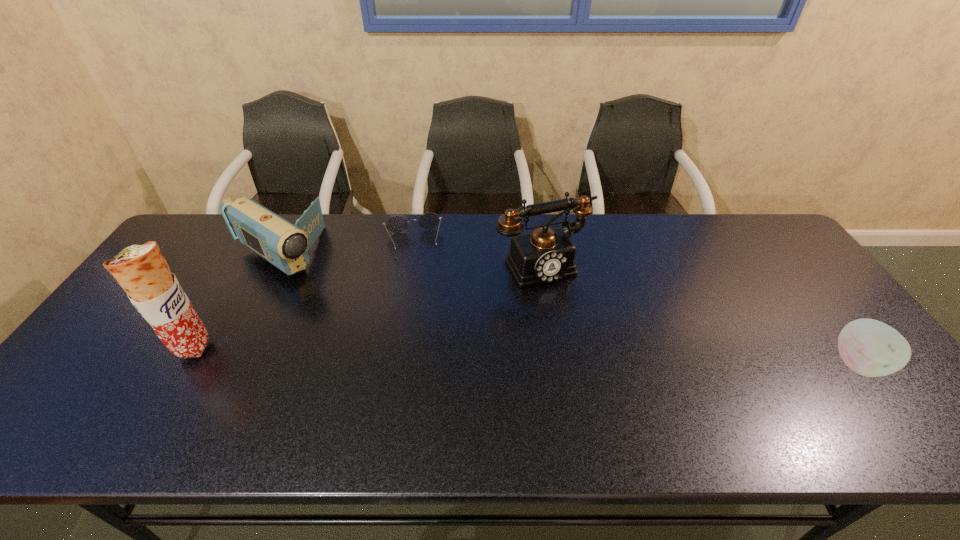
In order to click on free spot on the desktop that is between the burrito and the apple and is positioned on the front-facing side of the third object from left to right in this screenshot , I will do `click(422, 353)`.

Locate an element on the screen. free spot on the desktop that is between the burrito and the fourth tallest object and is positioned on the front of the fourth shortest object at the rotary dial is located at coordinates (600, 357).

Find the location of `vacant space on the desktop that is between the tallest object and the rightmost object and is positioned on the side of the third tallest object with the flip-out screen`. vacant space on the desktop that is between the tallest object and the rightmost object and is positioned on the side of the third tallest object with the flip-out screen is located at coordinates (429, 353).